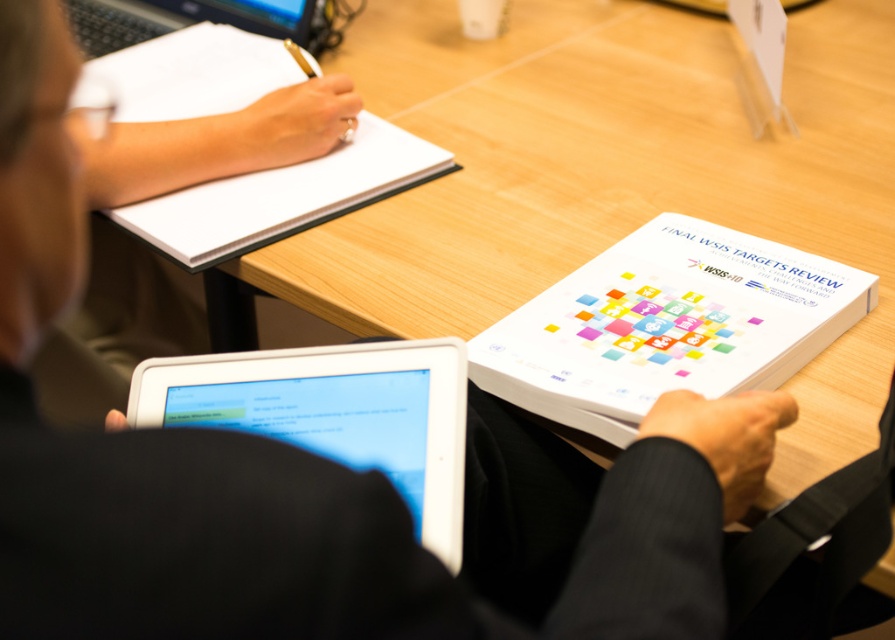
Who is more forward, (817, 337) or (374, 364)?

Point (374, 364) is in front.

From the picture: Can you confirm if white paper at center is positioned to the left of white glossy tablet at lower left?

Incorrect, white paper at center is not on the left side of white glossy tablet at lower left.

Is point (514, 310) farther from camera compared to point (458, 362)?

Yes, it is behind point (458, 362).

You are a GUI agent. You are given a task and a screenshot of the screen. Output one action in this format:
    pyautogui.click(x=<x>, y=<y>)
    Task: Click on the white paper at center
    This screenshot has width=895, height=640.
    Given the screenshot: What is the action you would take?
    pyautogui.click(x=667, y=324)

Is white paper at center positioned behind white paper at upper left?

No, white paper at center is closer to the viewer.

Does white paper at center appear over white paper at upper left?

No.

Is point (527, 333) positioned after point (286, 211)?

No, (527, 333) is in front of (286, 211).

You are a GUI agent. You are given a task and a screenshot of the screen. Output one action in this format:
    pyautogui.click(x=<x>, y=<y>)
    Task: Click on the white paper at center
    The height and width of the screenshot is (640, 895).
    Given the screenshot: What is the action you would take?
    pyautogui.click(x=667, y=324)

Can you confirm if white paper at center is bigger than black plastic laptop at upper left?

Correct, white paper at center is larger in size than black plastic laptop at upper left.

Is white paper at center positioned before black plastic laptop at upper left?

Yes, it is in front of black plastic laptop at upper left.

Does point (527, 401) come closer to viewer compared to point (88, 1)?

Yes, it is in front of point (88, 1).

At what (x,y) coordinates should I click in order to perform the action: click on white paper at center. Please return your answer as a coordinate pair (x, y). Image resolution: width=895 pixels, height=640 pixels. Looking at the image, I should click on (667, 324).